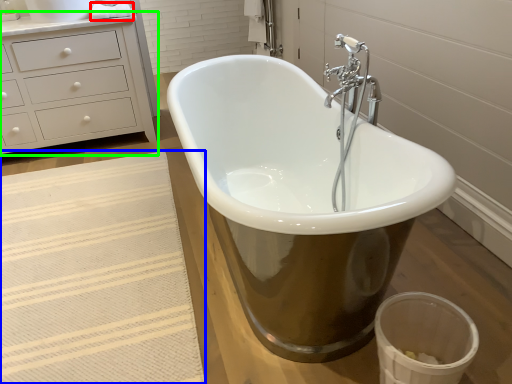
Question: Considering the real-world distances, which object is farthest from toilet paper (highlighted by a red box)? bath mat (highlighted by a blue box) or chest of drawers (highlighted by a green box)?

Choices:
 (A) bath mat
 (B) chest of drawers

Answer: (A)